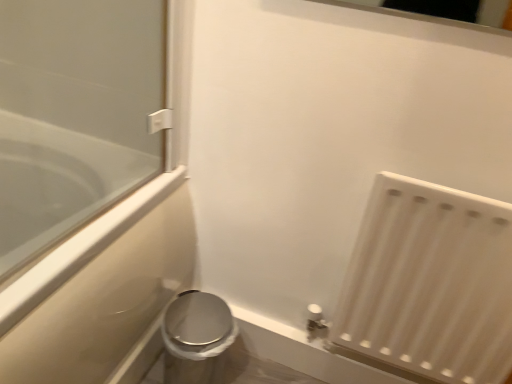
Question: From the image's perspective, is clear glass bathtub at left on satin silver toilet at lower left?

Choices:
 (A) no
 (B) yes

Answer: (B)

Question: Is clear glass bathtub at left touching satin silver toilet at lower left?

Choices:
 (A) no
 (B) yes

Answer: (A)

Question: Is clear glass bathtub at left not inside satin silver toilet at lower left?

Choices:
 (A) yes
 (B) no

Answer: (A)

Question: Is clear glass bathtub at left to the right of satin silver toilet at lower left from the viewer's perspective?

Choices:
 (A) no
 (B) yes

Answer: (A)

Question: Is clear glass bathtub at left positioned with its back to satin silver toilet at lower left?

Choices:
 (A) yes
 (B) no

Answer: (B)

Question: Relative to satin silver toilet at lower left, is white matte radiator at lower right in front or behind?

Choices:
 (A) front
 (B) behind

Answer: (A)

Question: Would you say white matte radiator at lower right is to the left or to the right of satin silver toilet at lower left in the picture?

Choices:
 (A) left
 (B) right

Answer: (B)

Question: From a real-world perspective, is white matte radiator at lower right above or below satin silver toilet at lower left?

Choices:
 (A) above
 (B) below

Answer: (A)

Question: From the image's perspective, is white matte radiator at lower right positioned above or below satin silver toilet at lower left?

Choices:
 (A) above
 (B) below

Answer: (A)

Question: Relative to satin silver toilet at lower left, is clear glass bathtub at left in front or behind?

Choices:
 (A) behind
 (B) front

Answer: (B)

Question: Looking at their shapes, would you say clear glass bathtub at left is wider or thinner than satin silver toilet at lower left?

Choices:
 (A) thin
 (B) wide

Answer: (B)

Question: In terms of size, does clear glass bathtub at left appear bigger or smaller than satin silver toilet at lower left?

Choices:
 (A) small
 (B) big

Answer: (B)

Question: Considering the positions of point (50, 145) and point (182, 360), is point (50, 145) closer or farther from the camera than point (182, 360)?

Choices:
 (A) closer
 (B) farther

Answer: (B)

Question: Is white matte radiator at lower right wider or thinner than clear glass bathtub at left?

Choices:
 (A) wide
 (B) thin

Answer: (B)

Question: From the image's perspective, is white matte radiator at lower right positioned above or below clear glass bathtub at left?

Choices:
 (A) above
 (B) below

Answer: (A)